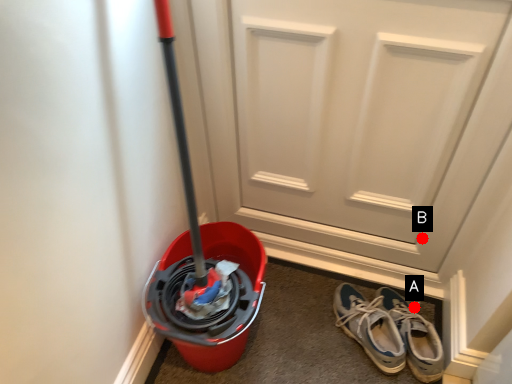
Question: Two points are circled on the image, labeled by A and B beside each circle. Which point is farther to the camera?

Choices:
 (A) A is further
 (B) B is further

Answer: (B)